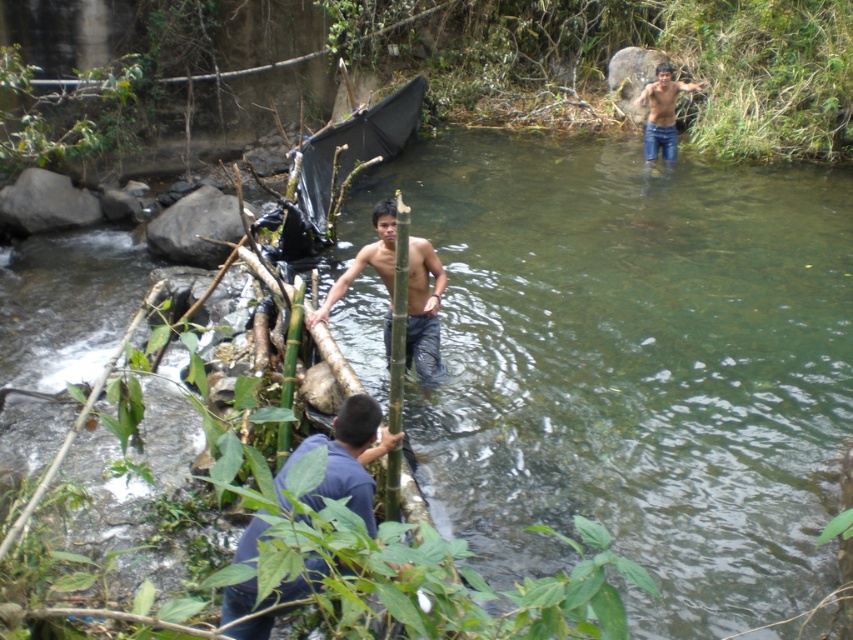
Question: Does clear water at center appear on the right side of jeans at upper right?

Choices:
 (A) yes
 (B) no

Answer: (B)

Question: Which is nearer to the smooth skin man at center?

Choices:
 (A) jeans at upper right
 (B) clear water at center
 (C) blue cotton shirt at lower center

Answer: (C)

Question: Which object is the closest to the blue cotton shirt at lower center?

Choices:
 (A) clear water at center
 (B) jeans at upper right

Answer: (A)

Question: Which point is farther from the camera taking this photo?

Choices:
 (A) (437, 337)
 (B) (654, 125)
 (C) (527, 376)
 (D) (251, 593)

Answer: (B)

Question: Is blue cotton shirt at lower center above smooth skin man at center?

Choices:
 (A) no
 (B) yes

Answer: (A)

Question: Does blue cotton shirt at lower center have a larger size compared to jeans at upper right?

Choices:
 (A) no
 (B) yes

Answer: (A)